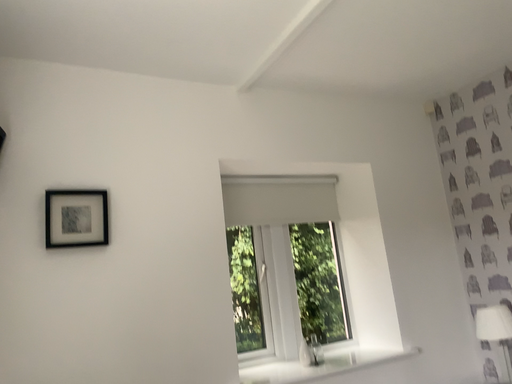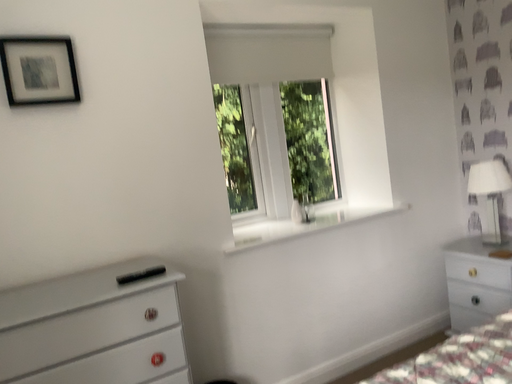
Question: How did the camera likely rotate when shooting the video?

Choices:
 (A) rotated upward
 (B) rotated downward

Answer: (B)